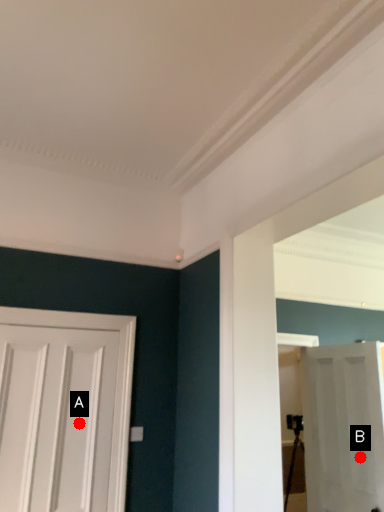
Question: Two points are circled on the image, labeled by A and B beside each circle. Which of the following is the farthest from the observer?

Choices:
 (A) A is further
 (B) B is further

Answer: (B)